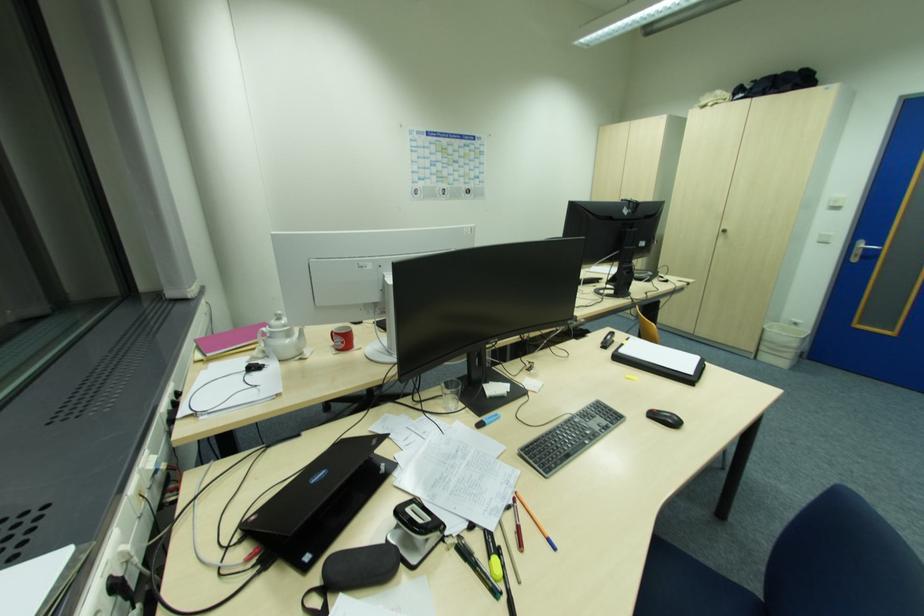
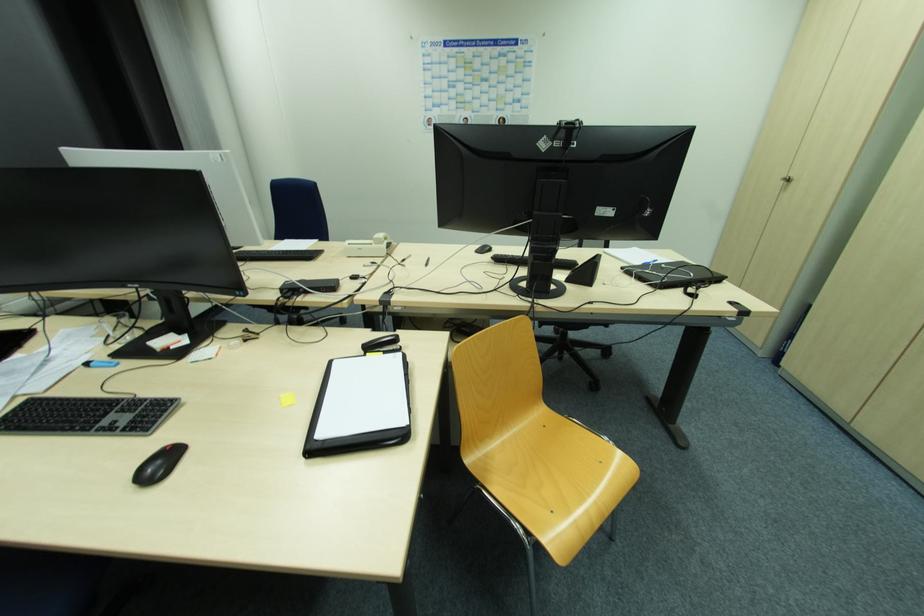
Locate, in the second image, the point that corresponds to point (625, 345) in the first image.

(368, 357)